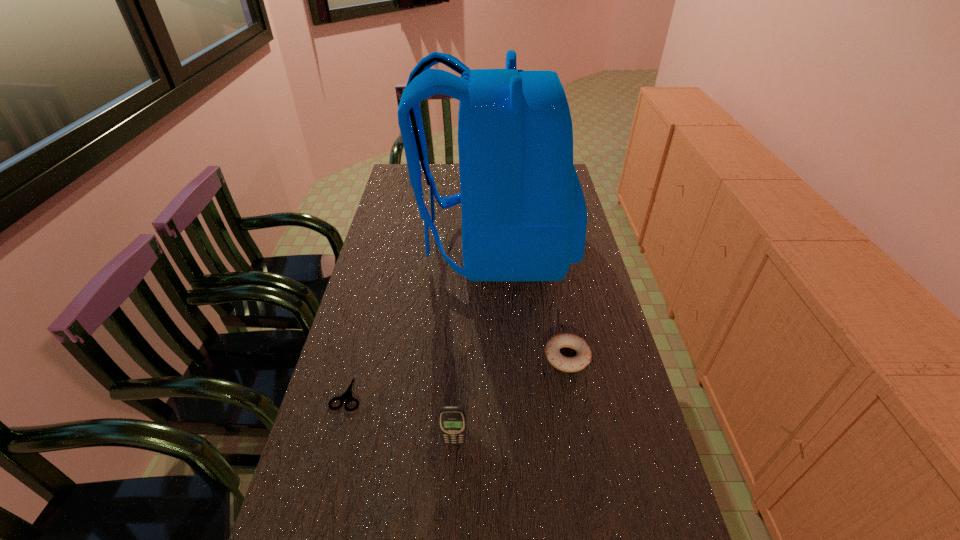
At what (x,y) coordinates should I click in order to perform the action: click on vacant area that satisfies the following two spatial constraints: 1. on the back of the second shortest object; 2. on the left side of the farthest object. Please return your answer as a coordinate pair (x, y). The width and height of the screenshot is (960, 540). Looking at the image, I should click on (499, 357).

At what (x,y) coordinates should I click in order to perform the action: click on free location that satisfies the following two spatial constraints: 1. on the back of the backpack; 2. on the screen of the cellular telephone. Please return your answer as a coordinate pair (x, y). Looking at the image, I should click on (503, 442).

You are a GUI agent. You are given a task and a screenshot of the screen. Output one action in this format:
    pyautogui.click(x=<x>, y=<y>)
    Task: Click on the vacant region that satisfies the following two spatial constraints: 1. on the back side of the doughnut; 2. on the back of the backpack
    
    Given the screenshot: What is the action you would take?
    pyautogui.click(x=546, y=247)

Find the location of `free point that satisfies the following two spatial constraints: 1. on the back side of the second shortest object; 2. on the back of the backpack`. free point that satisfies the following two spatial constraints: 1. on the back side of the second shortest object; 2. on the back of the backpack is located at coordinates (546, 247).

You are a GUI agent. You are given a task and a screenshot of the screen. Output one action in this format:
    pyautogui.click(x=<x>, y=<y>)
    Task: Click on the blank space that satisfies the following two spatial constraints: 1. on the back of the backpack; 2. on the screen of the nearest object
    This screenshot has width=960, height=540.
    Given the screenshot: What is the action you would take?
    pyautogui.click(x=503, y=442)

Locate an element on the screen. free space in the image that satisfies the following two spatial constraints: 1. on the back of the third tallest object; 2. on the right side of the farthest object is located at coordinates (499, 357).